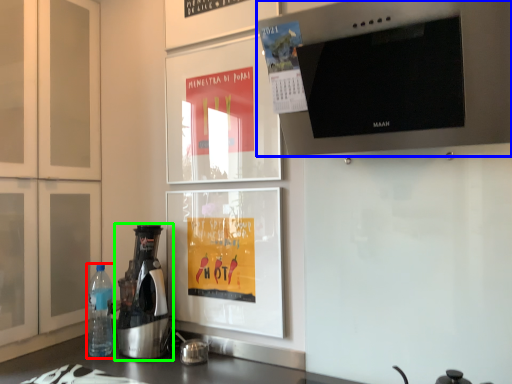
Question: Based on their relative distances, which object is nearer to bottle (highlighted by a red box)? Choose from home appliance (highlighted by a blue box) and kitchen appliance (highlighted by a green box).

Choices:
 (A) home appliance
 (B) kitchen appliance

Answer: (B)